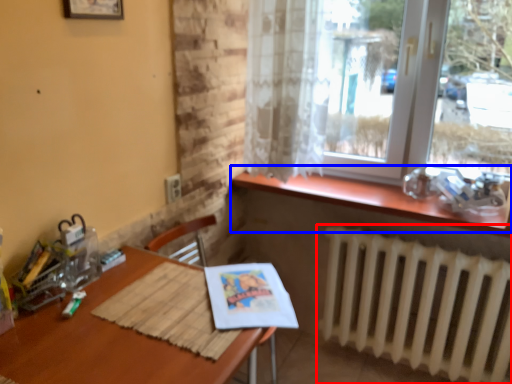
Question: Which of the following is the farthest to the observer, radiator (highlighted by a red box) or window sill (highlighted by a blue box)?

Choices:
 (A) radiator
 (B) window sill

Answer: (B)